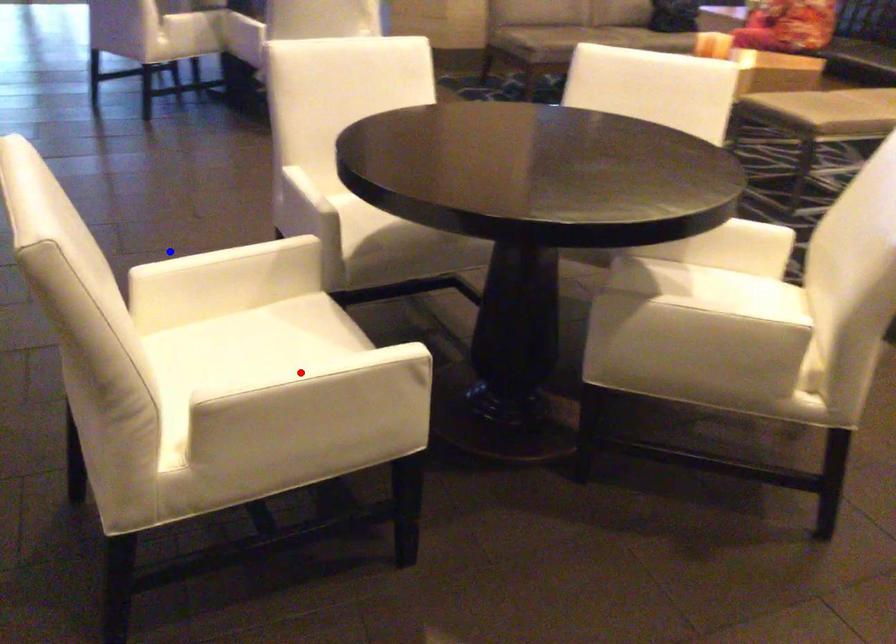
Question: In the image, two points are highlighted. Which point is nearer to the camera? Reply with the corresponding letter.

Choices:
 (A) blue point
 (B) red point

Answer: (B)